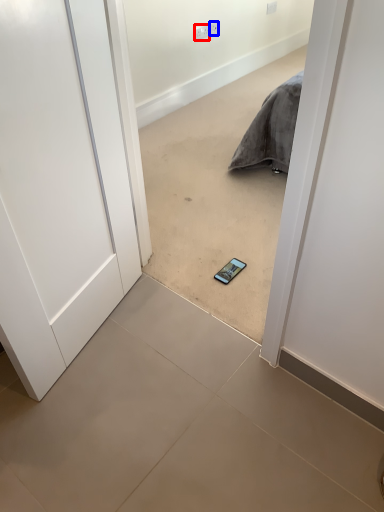
Question: Which point is further to the camera, electric outlet (highlighted by a red box) or electric outlet (highlighted by a blue box)?

Choices:
 (A) electric outlet
 (B) electric outlet

Answer: (B)